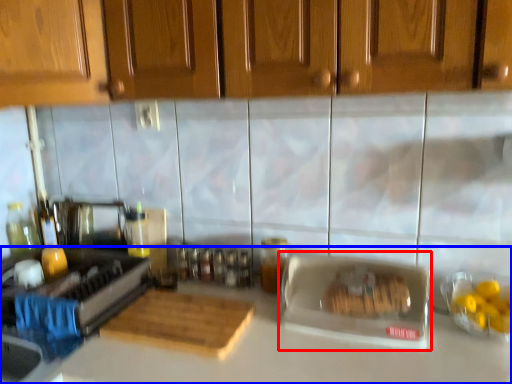
Question: Among these objects, which one is farthest to the camera, appliance (highlighted by a red box) or countertop (highlighted by a blue box)?

Choices:
 (A) appliance
 (B) countertop

Answer: (A)